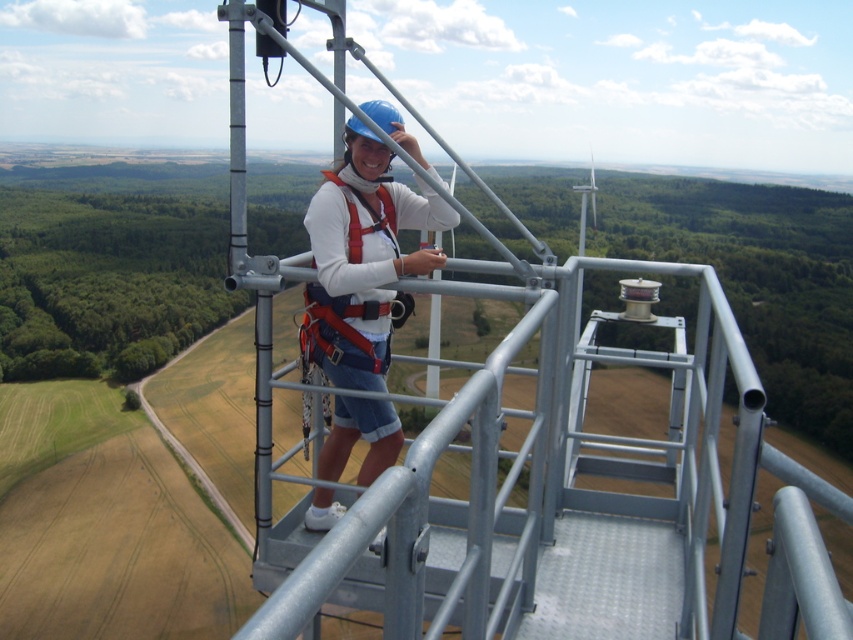
Question: Which point is closer to the camera taking this photo?

Choices:
 (A) (329, 504)
 (B) (392, 236)

Answer: (B)

Question: Does matte white shirt at center have a greater width compared to red nylon safety vest at center?

Choices:
 (A) yes
 (B) no

Answer: (A)

Question: Can you confirm if matte white shirt at center is smaller than red nylon safety vest at center?

Choices:
 (A) yes
 (B) no

Answer: (B)

Question: Does matte white shirt at center appear over red nylon safety vest at center?

Choices:
 (A) no
 (B) yes

Answer: (A)